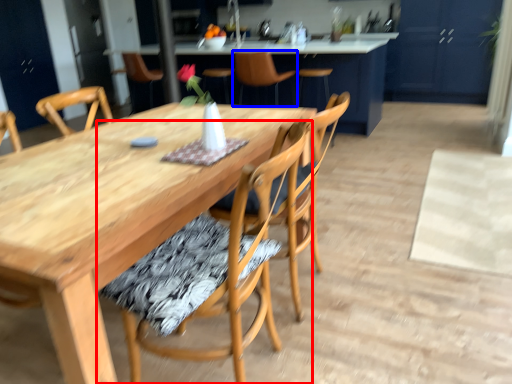
Question: Which object is further to the camera taking this photo, chair (highlighted by a red box) or chair (highlighted by a blue box)?

Choices:
 (A) chair
 (B) chair

Answer: (B)